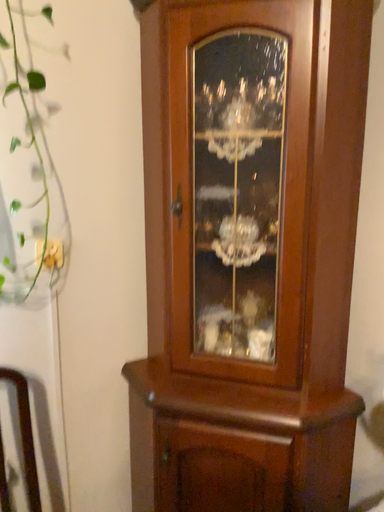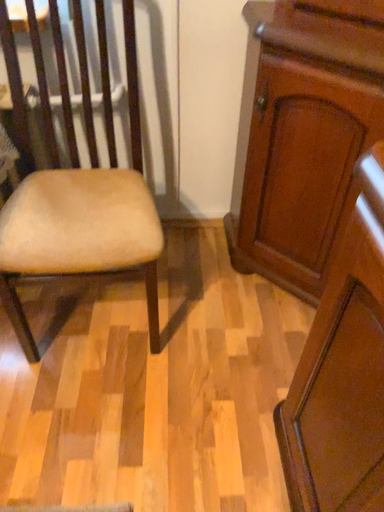
Question: Which way did the camera rotate in the video?

Choices:
 (A) rotated downward
 (B) rotated upward

Answer: (A)